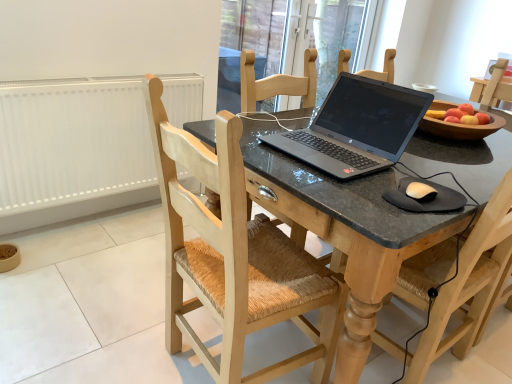
From the picture: In order to face white matte mouse at lower right, should I rotate leftwards or rightwards?

To align with it, rotate right about 21.217°.

What is the approximate width of black rubber mousepad at lower right?

The width of black rubber mousepad at lower right is 8.79 inches.

The image size is (512, 384). Describe the element at coordinates (469, 284) in the screenshot. I see `wooden woven seat at center, the 1th chair in the right-to-left sequence` at that location.

What do you see at coordinates (233, 255) in the screenshot? I see `light wood chair at center, which appears as the second chair when viewed from the right` at bounding box center [233, 255].

Locate an element on the screen. Image resolution: width=512 pixels, height=384 pixels. white matte mouse at lower right is located at coordinates (421, 192).

Who is bigger, transparent glass door at upper center or white matte radiator at left?

Bigger between the two is transparent glass door at upper center.

From a real-world perspective, who is located higher, transparent glass door at upper center or white matte radiator at left?

From a 3D spatial view, transparent glass door at upper center is above.

Is transparent glass door at upper center oriented away from white matte radiator at left?

transparent glass door at upper center is not turned away from white matte radiator at left.

Can you confirm if transparent glass door at upper center is positioned to the right of white matte radiator at left?

Yes.

Is light wood chair at center, positioned as the 1th chair in left-to-right order, turned away from wooden woven seat at center, which is the 2th chair in left-to-right order?

No, wooden woven seat at center, which is the 2th chair in left-to-right order, is not at the back of light wood chair at center, positioned as the 1th chair in left-to-right order.

Is point (324, 368) behind point (434, 276)?

Yes, it is.

From the image's perspective, is light wood chair at center, positioned as the 1th chair in left-to-right order, above or below wooden woven seat at center, the 1th chair in the right-to-left sequence?

light wood chair at center, positioned as the 1th chair in left-to-right order, is situated lower than wooden woven seat at center, the 1th chair in the right-to-left sequence, in the image.

From the picture: In the image, is matte black laptop at center positioned in front of or behind wooden woven seat at center, the 1th chair in the right-to-left sequence?

matte black laptop at center is positioned closer to the viewer than wooden woven seat at center, the 1th chair in the right-to-left sequence.

Between matte black laptop at center and wooden woven seat at center, which is the 2th chair in left-to-right order, which one has larger size?

matte black laptop at center is bigger.

Between matte black laptop at center and wooden woven seat at center, which is the 2th chair in left-to-right order, which one has larger width?

matte black laptop at center.

From the image's perspective, which one is positioned higher, black rubber mousepad at lower right or slate gray laptop at center?

slate gray laptop at center is shown above in the image.

Locate an element on the screen. Image resolution: width=512 pixels, height=384 pixels. laptop above the black rubber mousepad at lower right (from a real-world perspective) is located at coordinates (356, 128).

Is black rubber mousepad at lower right positioned with its back to slate gray laptop at center?

No, black rubber mousepad at lower right's orientation is not away from slate gray laptop at center.

In the scene shown: Is black rubber mousepad at lower right wider than slate gray laptop at center?

No, black rubber mousepad at lower right is not wider than slate gray laptop at center.

Consider the image. Between black rubber mousepad at lower right and wooden woven seat at center, which is the 2th chair in left-to-right order, which one appears on the left side from the viewer's perspective?

black rubber mousepad at lower right is more to the left.

Considering the positions of point (443, 195) and point (509, 185), is point (443, 195) closer or farther from the camera than point (509, 185)?

Point (443, 195) appears to be farther away from the viewer than point (509, 185).

Does black rubber mousepad at lower right have a smaller size compared to wooden woven seat at center, which is the 2th chair in left-to-right order?

Indeed, black rubber mousepad at lower right has a smaller size compared to wooden woven seat at center, which is the 2th chair in left-to-right order.

Is wooden woven seat at center, which is the 2th chair in left-to-right order, inside black rubber mousepad at lower right?

No, wooden woven seat at center, which is the 2th chair in left-to-right order, is not surrounded by black rubber mousepad at lower right.

Consider the image. Is white matte radiator at left to the left of matte black laptop at center from the viewer's perspective?

Yes, white matte radiator at left is to the left of matte black laptop at center.

Considering the positions of point (91, 189) and point (357, 230), is point (91, 189) closer or farther from the camera than point (357, 230)?

Point (91, 189).

Find the location of a particular element. This screenshot has width=512, height=384. desk lying below the white matte radiator at left (from the image's perspective) is located at coordinates (347, 221).

Can you confirm if white matte radiator at left is taller than matte black laptop at center?

In fact, white matte radiator at left may be shorter than matte black laptop at center.

From the image's perspective, is wooden woven seat at center, the 1th chair in the right-to-left sequence, located above or below black rubber mousepad at lower right?

wooden woven seat at center, the 1th chair in the right-to-left sequence, is below black rubber mousepad at lower right.

In the scene shown: Between wooden woven seat at center, which is the 2th chair in left-to-right order, and black rubber mousepad at lower right, which one appears on the right side from the viewer's perspective?

wooden woven seat at center, which is the 2th chair in left-to-right order.

Is the position of wooden woven seat at center, the 1th chair in the right-to-left sequence, more distant than that of black rubber mousepad at lower right?

No, wooden woven seat at center, the 1th chair in the right-to-left sequence, is closer to the camera.

Between wooden woven seat at center, the 1th chair in the right-to-left sequence, and black rubber mousepad at lower right, which one has smaller width?

Thinner between the two is black rubber mousepad at lower right.

Locate an element on the screen. glass door above the white matte radiator at left (from the image's perspective) is located at coordinates (290, 40).

The image size is (512, 384). Identify the location of chair on the left of the wooden woven seat at center, which is the 2th chair in left-to-right order. (233, 255).

In the scene shown: Looking at the image, which one is located further to light wood chair at center, positioned as the 1th chair in left-to-right order, transparent glass door at upper center or black rubber mousepad at lower right?

transparent glass door at upper center is positioned further to the anchor light wood chair at center, positioned as the 1th chair in left-to-right order.

When comparing their distances from wooden woven seat at center, the 1th chair in the right-to-left sequence, does transparent glass door at upper center or light wood chair at center, positioned as the 1th chair in left-to-right order, seem further?

transparent glass door at upper center is further to wooden woven seat at center, the 1th chair in the right-to-left sequence.

Considering their positions, is transparent glass door at upper center positioned further to white matte mouse at lower right than light wood chair at center, positioned as the 1th chair in left-to-right order?

The object further to white matte mouse at lower right is transparent glass door at upper center.

Based on their spatial positions, is light wood chair at center, positioned as the 1th chair in left-to-right order, or wooden woven seat at center, the 1th chair in the right-to-left sequence, further from slate gray laptop at center?

Based on the image, wooden woven seat at center, the 1th chair in the right-to-left sequence, appears to be further to slate gray laptop at center.

Which object lies further to the anchor point transparent glass door at upper center, wooden woven seat at center, the 1th chair in the right-to-left sequence, or white matte radiator at left?

wooden woven seat at center, the 1th chair in the right-to-left sequence, is further to transparent glass door at upper center.

Based on their spatial positions, is slate gray laptop at center or wooden woven seat at center, the 1th chair in the right-to-left sequence, closer to white matte mouse at lower right?

Based on the image, slate gray laptop at center appears to be nearer to white matte mouse at lower right.

From the image, which object appears to be farther from black rubber mousepad at lower right, white matte mouse at lower right or wooden woven seat at center, which is the 2th chair in left-to-right order?

Among the two, wooden woven seat at center, which is the 2th chair in left-to-right order, is located further to black rubber mousepad at lower right.

Which object lies nearer to the anchor point wooden woven seat at center, the 1th chair in the right-to-left sequence, black rubber mousepad at lower right or transparent glass door at upper center?

The object closer to wooden woven seat at center, the 1th chair in the right-to-left sequence, is black rubber mousepad at lower right.

This screenshot has width=512, height=384. Identify the location of laptop between light wood chair at center, which appears as the second chair when viewed from the right, and white matte mouse at lower right from left to right. (356, 128).

I want to click on chair between light wood chair at center, which appears as the second chair when viewed from the right, and transparent glass door at upper center, along the z-axis, so click(469, 284).

The height and width of the screenshot is (384, 512). Find the location of `laptop located between white matte radiator at left and white matte mouse at lower right in the left-right direction`. laptop located between white matte radiator at left and white matte mouse at lower right in the left-right direction is located at coordinates (356, 128).

Locate an element on the screen. The image size is (512, 384). mousepad between matte black laptop at center and transparent glass door at upper center in the front-back direction is located at coordinates (425, 198).